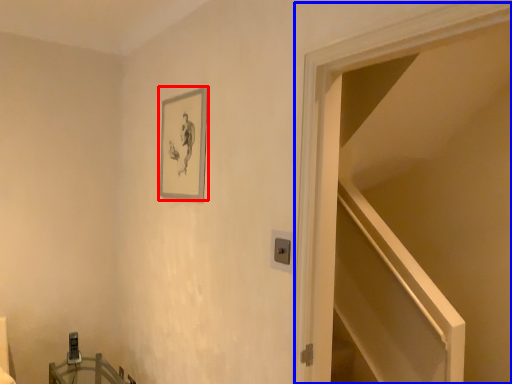
Question: Which of the following is the closest to the observer, picture frame (highlighted by a red box) or door (highlighted by a blue box)?

Choices:
 (A) picture frame
 (B) door

Answer: (B)